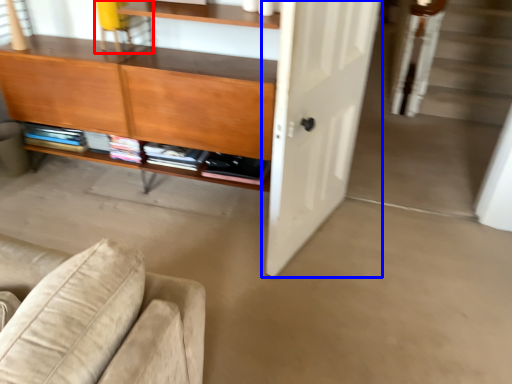
Question: Which point is closer to the camera, chair (highlighted by a red box) or door (highlighted by a blue box)?

Choices:
 (A) chair
 (B) door

Answer: (B)